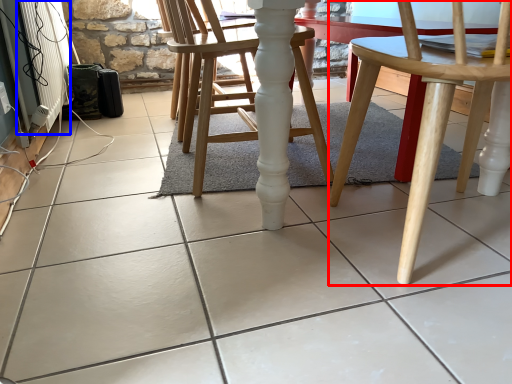
Question: Among these objects, which one is nearest to the camera, chair (highlighted by a red box) or radiator (highlighted by a blue box)?

Choices:
 (A) chair
 (B) radiator

Answer: (A)